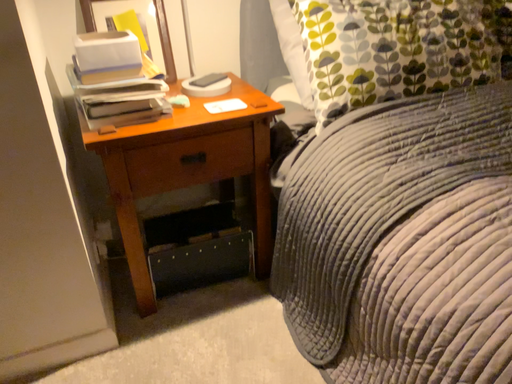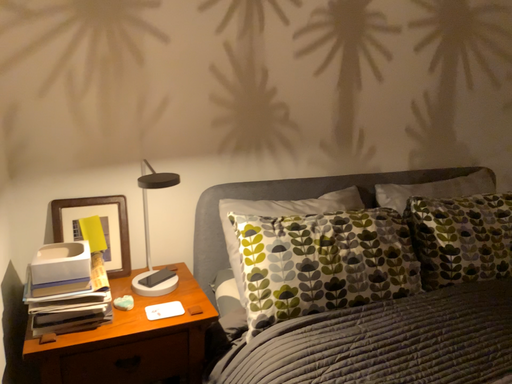
Question: Which way did the camera rotate in the video?

Choices:
 (A) rotated downward
 (B) rotated upward

Answer: (B)